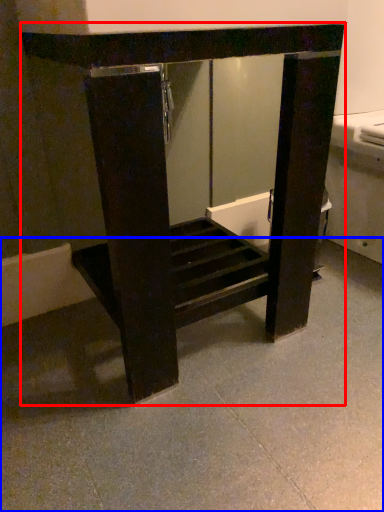
Question: Among these objects, which one is nearest to the camera, furniture (highlighted by a red box) or concrete (highlighted by a blue box)?

Choices:
 (A) furniture
 (B) concrete

Answer: (B)